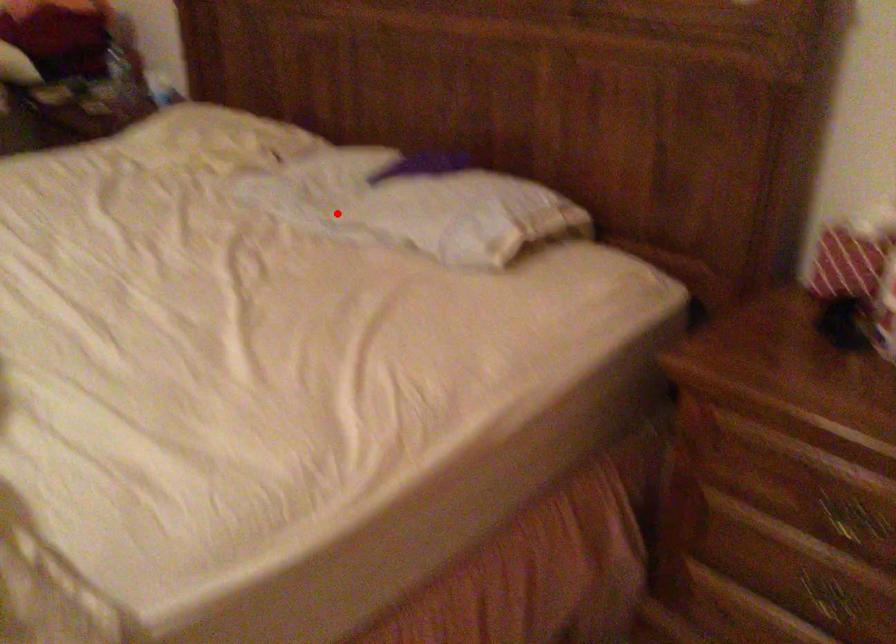
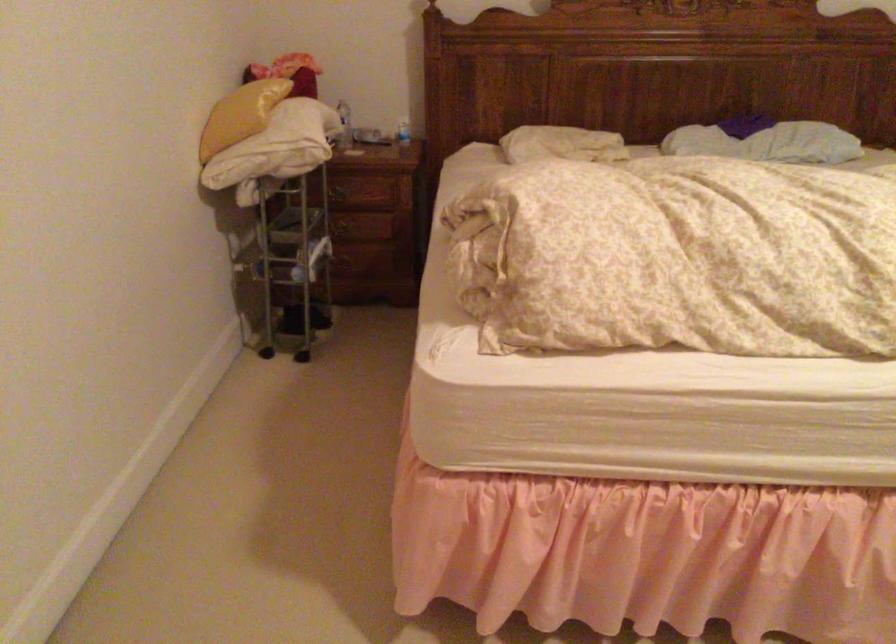
Question: I am providing you with two images of the same scene from different viewpoints. Image1 has a red point marked. In image2, the corresponding 3D location appears at what relative position? Reply with the corresponding letter.

Choices:
 (A) Closer
 (B) Farther

Answer: (B)